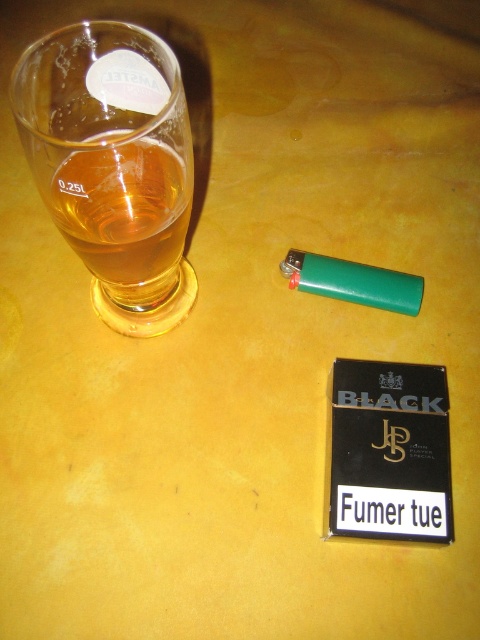
Which is more to the left, transparent glass beer at left or translucent amber liquid at left?

translucent amber liquid at left is more to the left.

What are the coordinates of `transparent glass beer at left` in the screenshot? It's located at (113, 164).